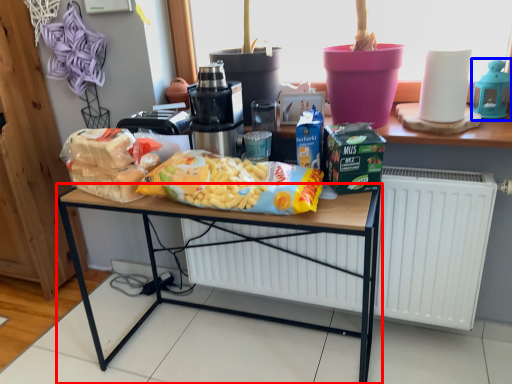
Question: Which of the following is the closest to the observer, desk (highlighted by a red box) or appliance (highlighted by a blue box)?

Choices:
 (A) desk
 (B) appliance

Answer: (A)